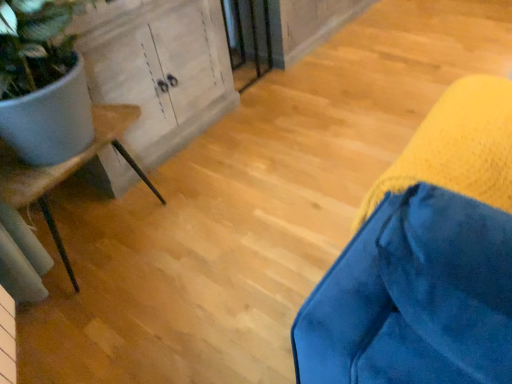
Where is `free point below white matte plant pot at left, the 2th furniture in the right-to-left sequence (from a real-world perspective)`? free point below white matte plant pot at left, the 2th furniture in the right-to-left sequence (from a real-world perspective) is located at coordinates (109, 233).